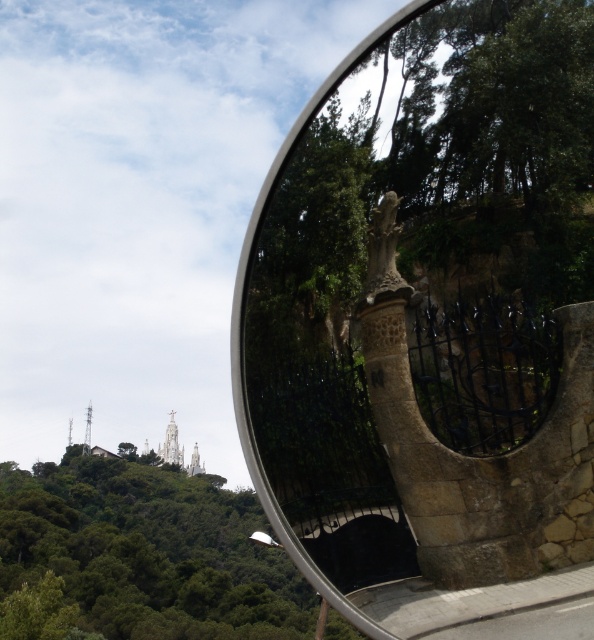
Question: Which of the following is the closest to the observer?

Choices:
 (A) (580, 209)
 (B) (121, 492)

Answer: (A)

Question: Does stone statue at center have a greater width compared to green leafy tree at upper center?

Choices:
 (A) no
 (B) yes

Answer: (A)

Question: Does stone statue at center come behind green leafy tree at upper center?

Choices:
 (A) no
 (B) yes

Answer: (A)

Question: Which point is farther from the camera taking this photo?

Choices:
 (A) (353, 76)
 (B) (26, 580)

Answer: (B)

Question: Does stone statue at center have a lesser width compared to green leafy tree at upper center?

Choices:
 (A) yes
 (B) no

Answer: (A)